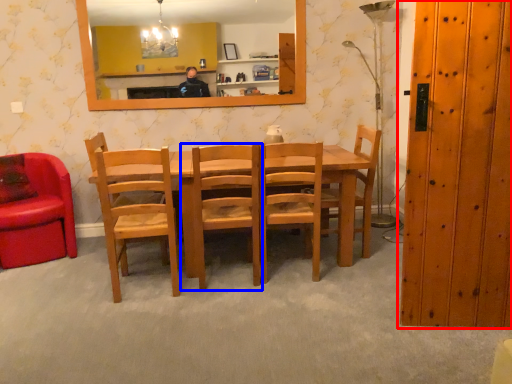
Question: Which of the following is the farthest to the observer, door (highlighted by a red box) or chair (highlighted by a blue box)?

Choices:
 (A) door
 (B) chair

Answer: (B)